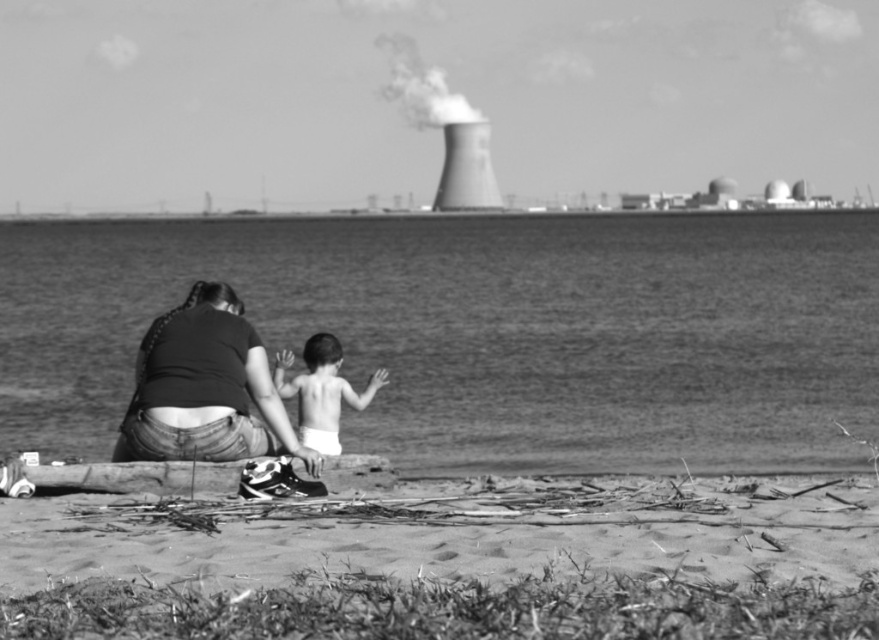
Question: Is smooth sand at lower center smaller than smooth skin baby at center?

Choices:
 (A) yes
 (B) no

Answer: (A)

Question: Is smooth water at lower center smaller than smooth skin baby at center?

Choices:
 (A) yes
 (B) no

Answer: (B)

Question: Which object is closer to the camera taking this photo?

Choices:
 (A) smooth water at lower center
 (B) smooth sand at lower center

Answer: (B)

Question: From the image, what is the correct spatial relationship of smooth water at lower center in relation to denim jeans at lower left?

Choices:
 (A) below
 (B) above

Answer: (B)

Question: Among these objects, which one is farthest from the camera?

Choices:
 (A) denim jeans at lower left
 (B) smooth skin baby at center
 (C) smooth sand at lower center

Answer: (B)

Question: Among these objects, which one is nearest to the camera?

Choices:
 (A) smooth sand at lower center
 (B) smooth water at lower center
 (C) denim jeans at lower left

Answer: (A)